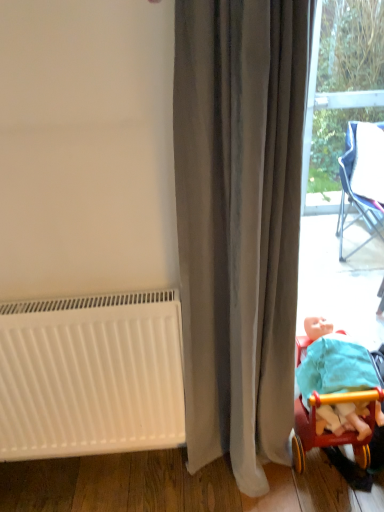
Question: Considering the positions of gray velvet curtain at center and white matte radiator at lower left in the image, is gray velvet curtain at center bigger or smaller than white matte radiator at lower left?

Choices:
 (A) big
 (B) small

Answer: (A)

Question: In the image, is gray velvet curtain at center positioned in front of or behind white matte radiator at lower left?

Choices:
 (A) behind
 (B) front

Answer: (B)

Question: Which object is positioned farthest from the gray velvet curtain at center?

Choices:
 (A) wooden toy carriage at lower right
 (B) white matte radiator at lower left

Answer: (A)

Question: Which object is the farthest from the gray velvet curtain at center?

Choices:
 (A) white matte radiator at lower left
 (B) wooden toy carriage at lower right

Answer: (B)